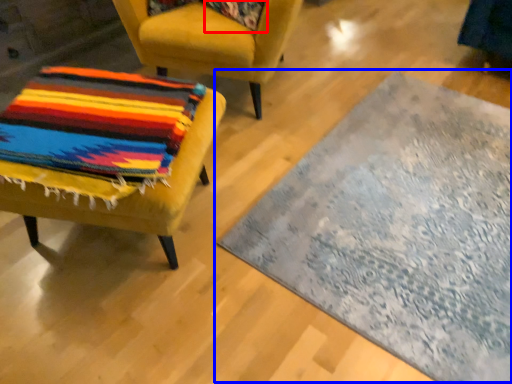
Question: Which of the following is the closest to the observer, pillow (highlighted by a red box) or mat (highlighted by a blue box)?

Choices:
 (A) pillow
 (B) mat

Answer: (B)